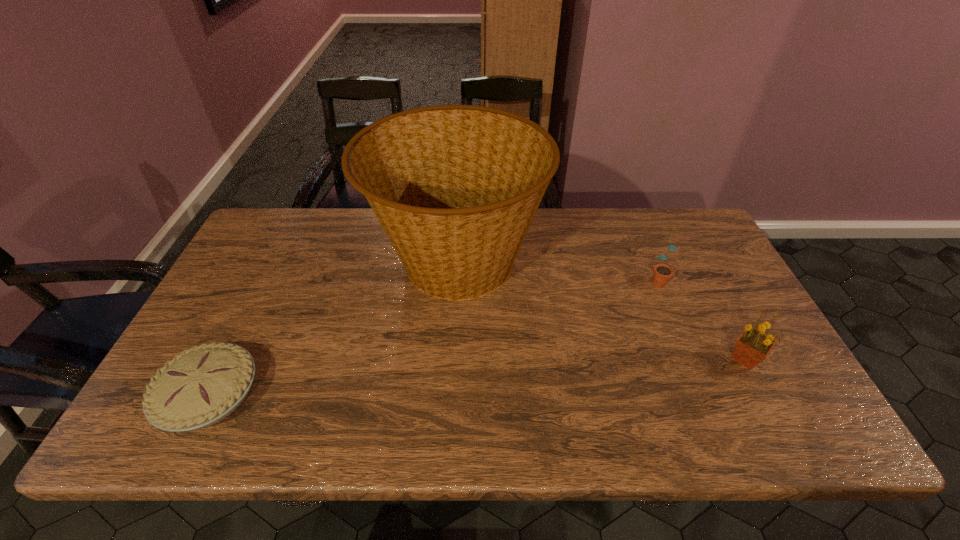
In order to click on vacant region between the shortest object and the right sunflower in this screenshot , I will do `click(477, 377)`.

The image size is (960, 540). I want to click on vacant area between the pie and the second object from left to right, so (x=333, y=329).

Image resolution: width=960 pixels, height=540 pixels. In order to click on vacant area between the third object from left to right and the tallest object in this screenshot , I will do click(x=557, y=271).

Locate an element on the screen. This screenshot has height=540, width=960. unoccupied position between the third object from left to right and the rightmost object is located at coordinates (701, 318).

Where is `object that ranks as the second closest to the shortest object`? This screenshot has height=540, width=960. object that ranks as the second closest to the shortest object is located at coordinates (x=662, y=272).

Select which object is the third closest to the farther sunflower. Please provide its 2D coordinates. Your answer should be formatted as a tuple, i.e. [(x, y)], where the tuple contains the x and y coordinates of a point satisfying the conditions above.

[(203, 385)]

Identify the location of free region that satisfies the following two spatial constraints: 1. on the back side of the basket; 2. on the right side of the leftmost object. click(x=276, y=262).

Where is `vacant point that satisfies the following two spatial constraints: 1. on the back side of the tallest object; 2. on the left side of the shortest object`? vacant point that satisfies the following two spatial constraints: 1. on the back side of the tallest object; 2. on the left side of the shortest object is located at coordinates click(x=276, y=262).